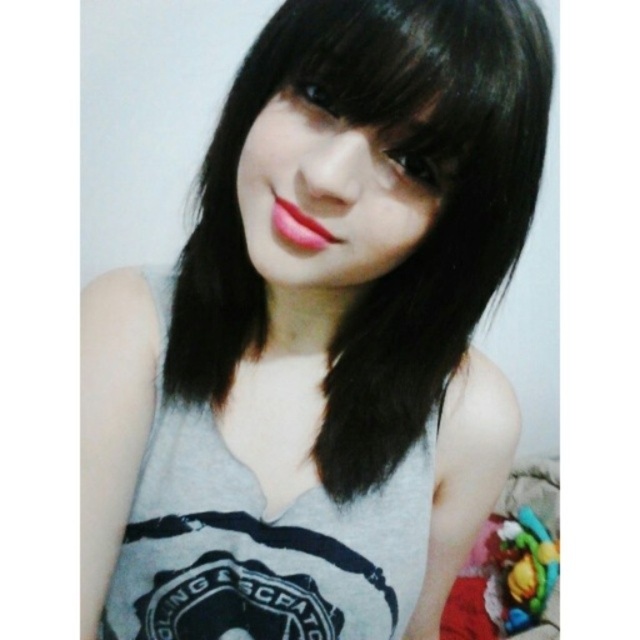
Question: Can you confirm if matte black hair at center is thinner than matte pink lipstick at center?

Choices:
 (A) yes
 (B) no

Answer: (B)

Question: Can you confirm if gray matte tank top at center is positioned to the left of matte pink lipstick at center?

Choices:
 (A) yes
 (B) no

Answer: (B)

Question: Among these objects, which one is farthest from the camera?

Choices:
 (A) matte black hair at center
 (B) matte pink lipstick at center
 (C) gray cotton tank top at center
 (D) gray matte tank top at center

Answer: (C)

Question: Is gray cotton tank top at center smaller than matte black hair at center?

Choices:
 (A) no
 (B) yes

Answer: (A)

Question: Which of the following is the closest to the observer?

Choices:
 (A) (371, 605)
 (B) (476, 60)

Answer: (B)

Question: Among these points, which one is farthest from the camera?

Choices:
 (A) (204, 483)
 (B) (232, 88)
 (C) (308, 260)
 (D) (296, 227)

Answer: (B)